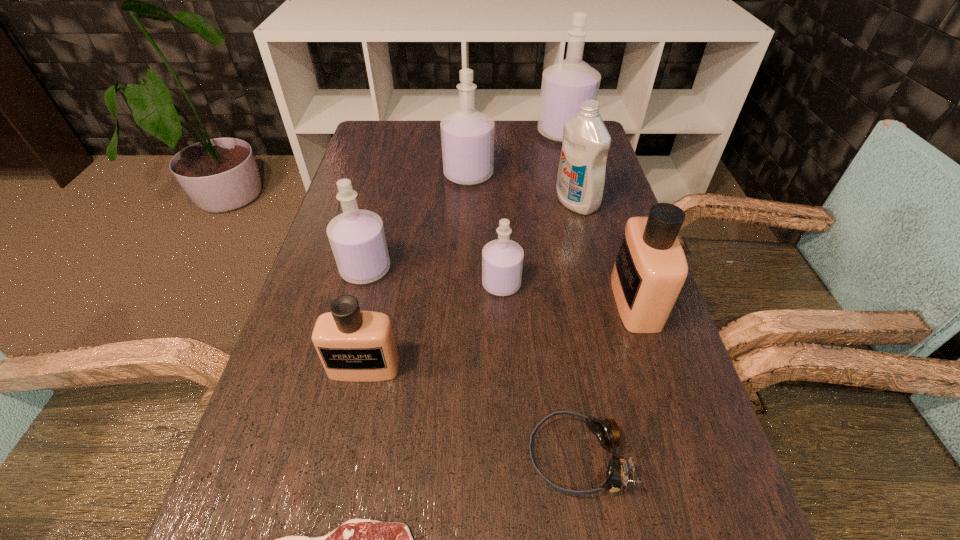
The image size is (960, 540). What are the coordinates of `free spot located 0.190m on the back of the smallest purple perfume` in the screenshot? It's located at (498, 219).

Where is `vacant position located 0.250m on the front label of the nearer beige perfume`? This screenshot has height=540, width=960. vacant position located 0.250m on the front label of the nearer beige perfume is located at coordinates (328, 535).

You are a GUI agent. You are given a task and a screenshot of the screen. Output one action in this format:
    pyautogui.click(x=<x>, y=<y>)
    Task: Click on the vacant space located through the lenses of the second shortest object
    
    Given the screenshot: What is the action you would take?
    pyautogui.click(x=321, y=457)

Find the location of a particular element. The image size is (960, 540). blank space located through the lenses of the second shortest object is located at coordinates (406, 457).

You are a GUI agent. You are given a task and a screenshot of the screen. Output one action in this format:
    pyautogui.click(x=<x>, y=<y>)
    Task: Click on the free space located through the lenses of the second shortest object
    
    Given the screenshot: What is the action you would take?
    click(x=326, y=457)

Image resolution: width=960 pixels, height=540 pixels. I want to click on object that is at the far edge, so click(565, 85).

Find the location of a particular element. This screenshot has height=540, width=960. detergent at the right edge is located at coordinates (580, 183).

The image size is (960, 540). I want to click on goggles present at the right edge, so click(x=606, y=431).

At what (x,y) coordinates should I click in order to perform the action: click on object located at the far right corner. Please return your answer as a coordinate pair (x, y). Looking at the image, I should click on (565, 85).

I want to click on vacant position at the far edge of the desktop, so click(x=522, y=151).